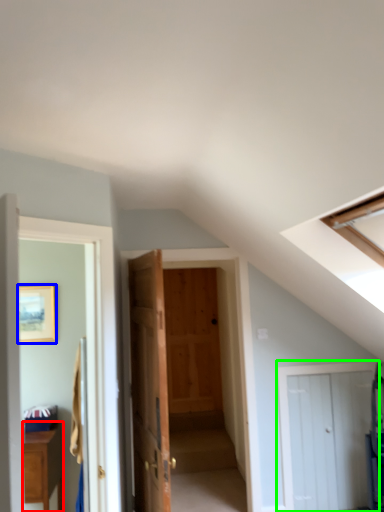
Question: Estimate the real-world distances between objects in this image. Which object is farther from cabinetry (highlighted by a red box), picture frame (highlighted by a blue box) or door (highlighted by a green box)?

Choices:
 (A) picture frame
 (B) door

Answer: (B)